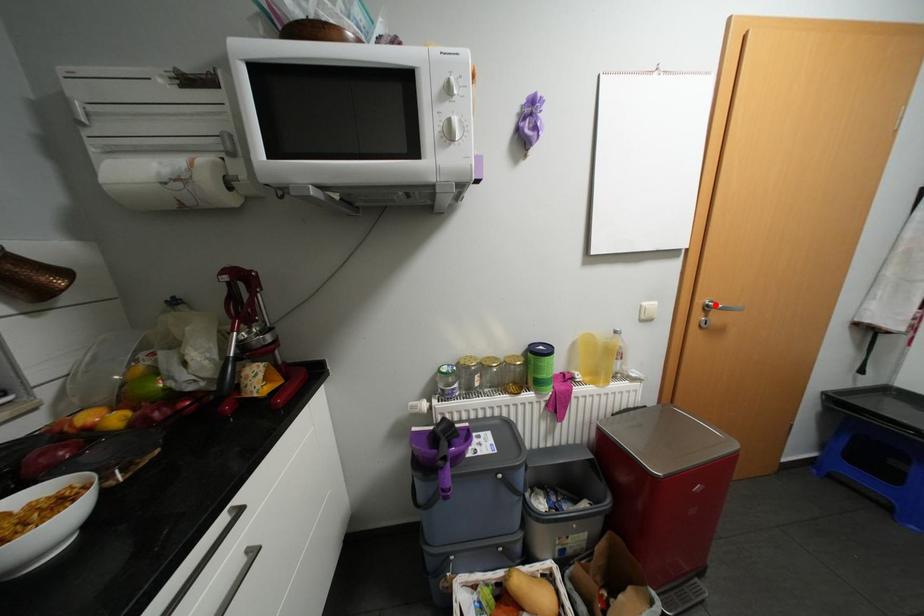
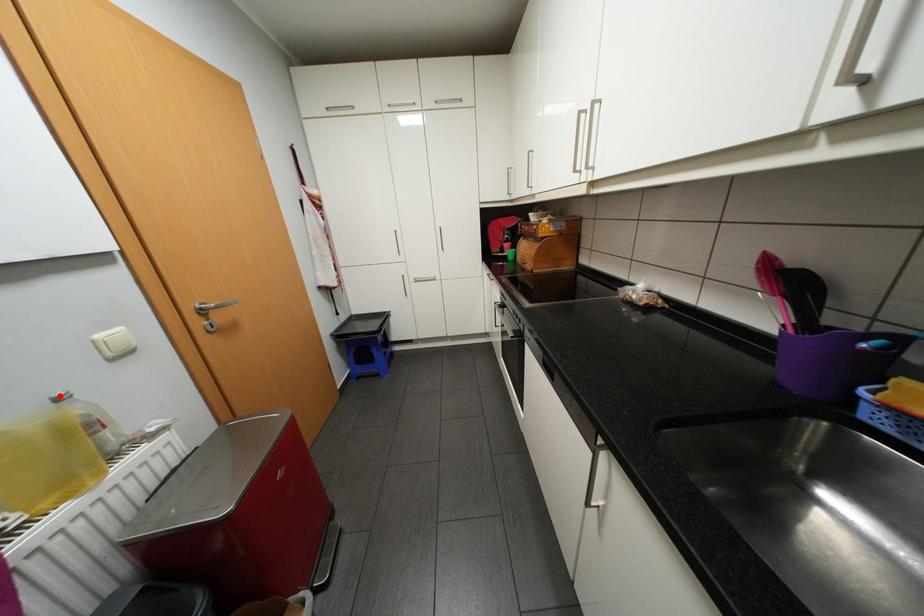
I am providing you with two images of the same scene from different viewpoints. A red point is marked on the first image and another point is marked on the second image. Does the point marked in image1 correspond to the same location as the one in image2?

No